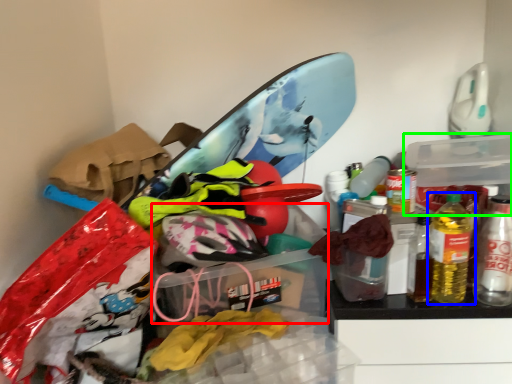
Question: Which is farther away from storage box (highlighted by a red box)? bottle (highlighted by a blue box) or storage box (highlighted by a green box)?

Choices:
 (A) bottle
 (B) storage box

Answer: (B)